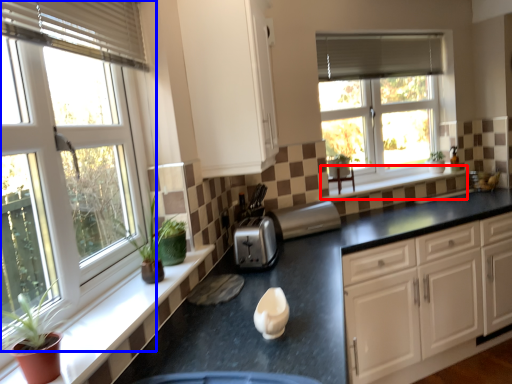
Question: Which of the following is the farthest to the observer, window sill (highlighted by a red box) or window (highlighted by a blue box)?

Choices:
 (A) window sill
 (B) window

Answer: (A)